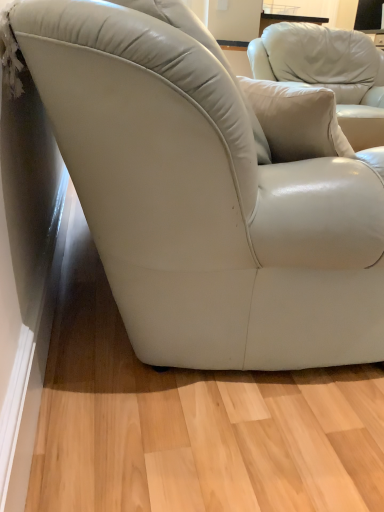
At what (x,y) coordinates should I click in order to perform the action: click on matte white armchair at center. Please return your answer as a coordinate pair (x, y). Looking at the image, I should click on (220, 183).

The height and width of the screenshot is (512, 384). Describe the element at coordinates (220, 183) in the screenshot. I see `matte white armchair at center` at that location.

Locate an element on the screen. Image resolution: width=384 pixels, height=512 pixels. matte white armchair at center is located at coordinates (220, 183).